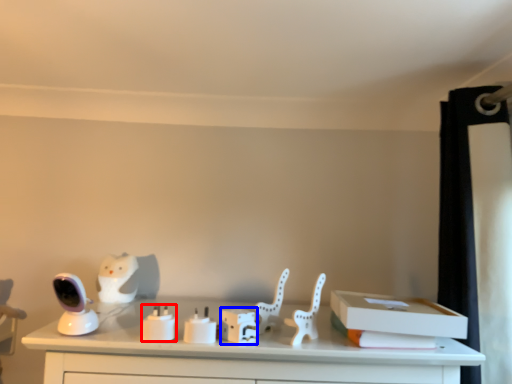
Question: Which object appears farthest to the camera in this image, candle holder (highlighted by a red box) or box (highlighted by a blue box)?

Choices:
 (A) candle holder
 (B) box

Answer: (B)